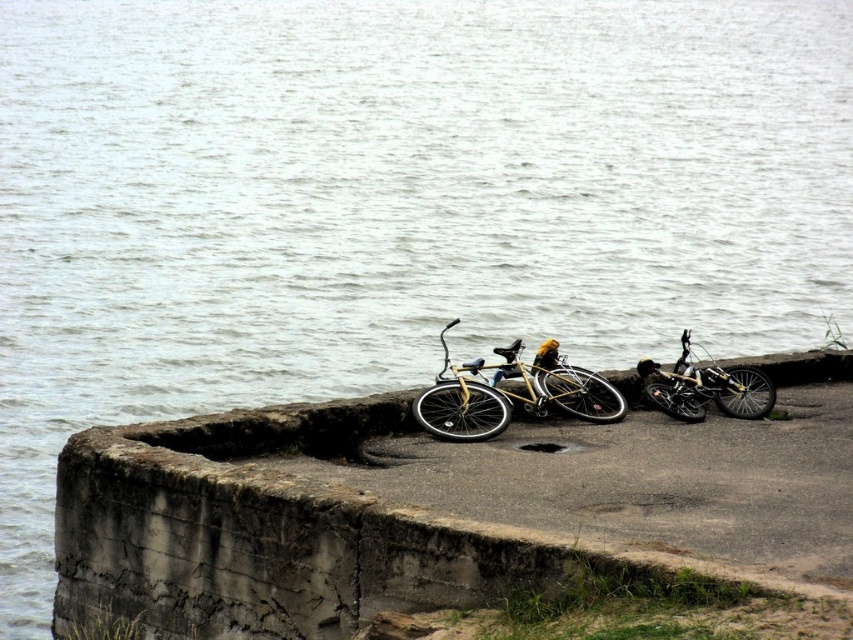
Question: Is concrete at center positioned before shiny metallic bicycle at right?

Choices:
 (A) no
 (B) yes

Answer: (B)

Question: Which of the following is the farthest from the observer?

Choices:
 (A) (602, 403)
 (B) (733, 413)
 (C) (700, 566)

Answer: (B)

Question: Which object is farther from the camera taking this photo?

Choices:
 (A) concrete at center
 (B) yellow matte bicycle at center
 (C) shiny metallic bicycle at right

Answer: (C)

Question: Does yellow matte bicycle at center have a greater width compared to shiny metallic bicycle at right?

Choices:
 (A) no
 (B) yes

Answer: (A)

Question: Which object is farther from the camera taking this photo?

Choices:
 (A) concrete at center
 (B) shiny metallic bicycle at right

Answer: (B)

Question: Does yellow matte bicycle at center have a greater width compared to shiny metallic bicycle at right?

Choices:
 (A) yes
 (B) no

Answer: (B)